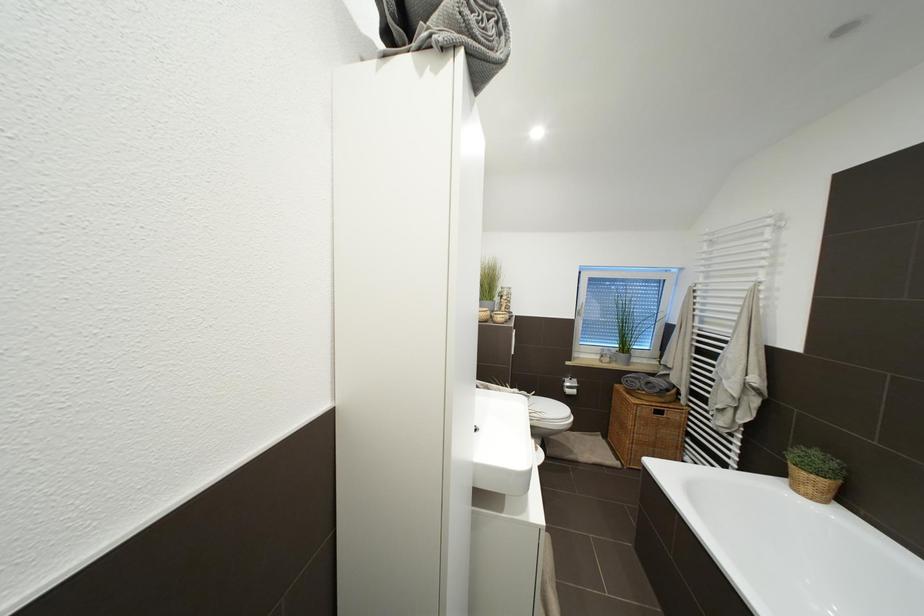
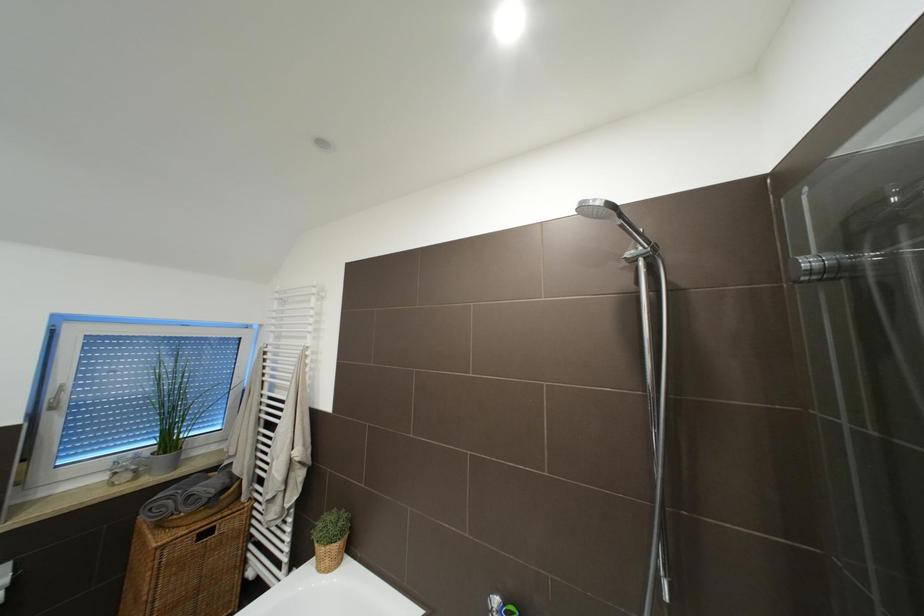
Question: The camera is either moving clockwise (left) or counter-clockwise (right) around the object. The first image is from the beginning of the video and the second image is from the end. Is the camera moving left or right when shooting the video?

Choices:
 (A) Left
 (B) Right

Answer: (A)